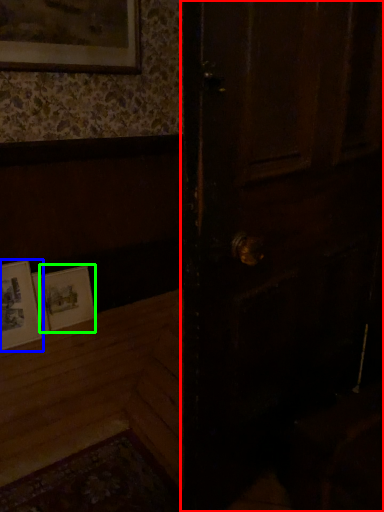
Question: Estimate the real-world distances between objects in this image. Which object is closer to door (highlighted by a red box), picture frame (highlighted by a blue box) or picture frame (highlighted by a green box)?

Choices:
 (A) picture frame
 (B) picture frame

Answer: (B)